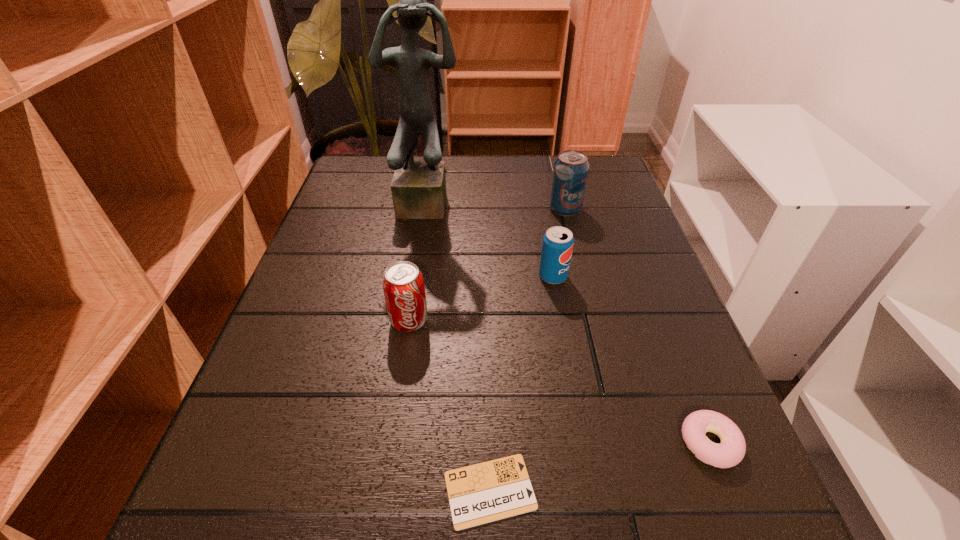
Find the location of a particular element. vacant region that satisfies the following two spatial constraints: 1. on the front side of the leftmost soda can; 2. on the right side of the rightmost object is located at coordinates coord(390,443).

This screenshot has width=960, height=540. In order to click on blank space that satisfies the following two spatial constraints: 1. on the face of the farthest soda can; 2. on the left side of the tallest object in this screenshot , I will do `click(428, 208)`.

Locate an element on the screen. free location that satisfies the following two spatial constraints: 1. on the back side of the farthest soda can; 2. on the right side of the nearest soda can is located at coordinates (426, 208).

Locate an element on the screen. This screenshot has height=540, width=960. vacant space that satisfies the following two spatial constraints: 1. on the back side of the nearest soda can; 2. on the right side of the farthest soda can is located at coordinates (426, 208).